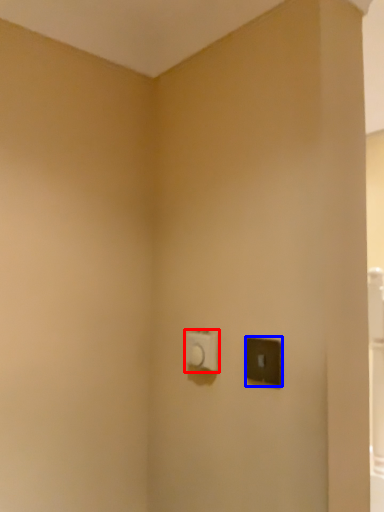
Question: Which object appears closest to the camera in this image, light switch (highlighted by a red box) or light switch (highlighted by a blue box)?

Choices:
 (A) light switch
 (B) light switch

Answer: (B)